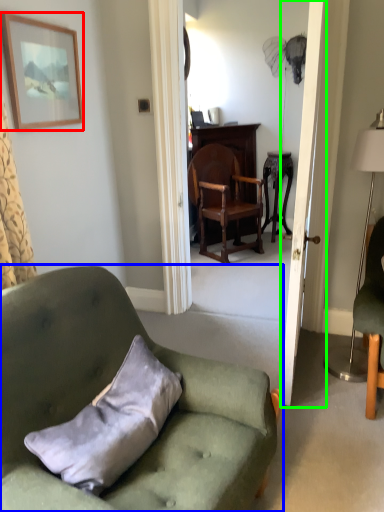
Question: Considering the real-world distances, which object is closest to picture frame (highlighted by a red box)? chair (highlighted by a blue box) or door (highlighted by a green box).

Choices:
 (A) chair
 (B) door

Answer: (A)